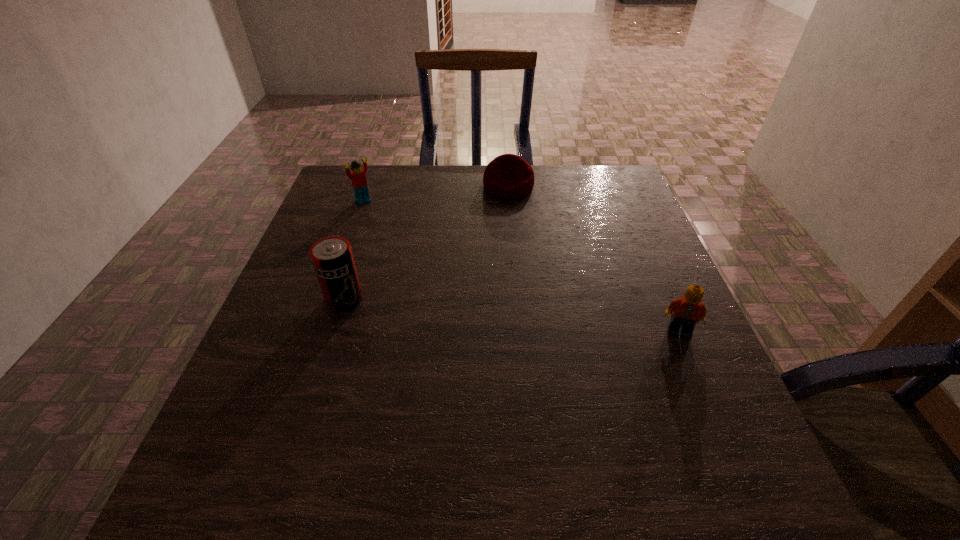
Identify the location of free location located 0.130m on the face of the farther Lego. Image resolution: width=960 pixels, height=540 pixels. (392, 226).

The image size is (960, 540). Find the location of `free space located 0.090m on the face of the farther Lego`. free space located 0.090m on the face of the farther Lego is located at coordinates (384, 219).

This screenshot has height=540, width=960. I want to click on free region located 0.170m on the seat area of the shortest object, so click(512, 237).

Identify the location of blank space located 0.070m on the seat area of the shortest object. The height and width of the screenshot is (540, 960). (510, 215).

The image size is (960, 540). Identify the location of free space located 0.150m on the seat area of the shortest object. (512, 233).

Locate an element on the screen. The height and width of the screenshot is (540, 960). Lego present at the far edge is located at coordinates (358, 178).

I want to click on beanbag located in the far edge section of the desktop, so point(508,176).

Where is `can that is at the left edge`? The width and height of the screenshot is (960, 540). can that is at the left edge is located at coordinates (332, 258).

At what (x,y) coordinates should I click in order to perform the action: click on Lego at the left edge. Please return your answer as a coordinate pair (x, y). Looking at the image, I should click on (358, 178).

This screenshot has width=960, height=540. Identify the location of object that is at the right edge. (688, 310).